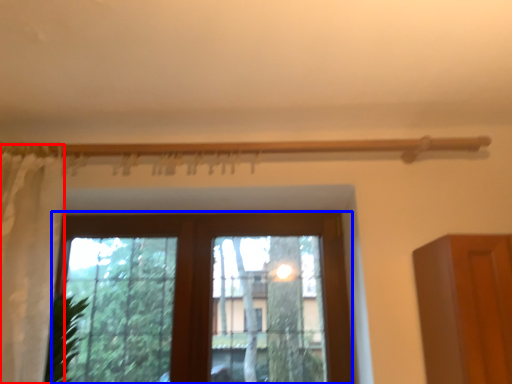
Question: Which object is further to the camera taking this photo, curtain (highlighted by a red box) or window (highlighted by a blue box)?

Choices:
 (A) curtain
 (B) window

Answer: (B)